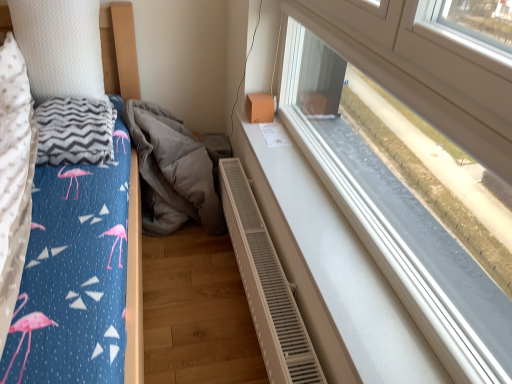
Question: From the image's perspective, is gray fabric at lower center located above or below white textured radiator at lower center?

Choices:
 (A) below
 (B) above

Answer: (B)

Question: Does point (172, 155) appear closer or farther from the camera than point (231, 205)?

Choices:
 (A) farther
 (B) closer

Answer: (A)

Question: Based on their relative distances, which object is farther from the white textured radiator at lower center?

Choices:
 (A) gray zigzag-patterned blanket at left
 (B) gray fabric at lower center
 (C) white plastic window at upper right
 (D) white textured pillow at upper left

Answer: (D)

Question: Which object is the farthest from the white plastic window at upper right?

Choices:
 (A) white textured pillow at upper left
 (B) gray zigzag-patterned blanket at left
 (C) white textured radiator at lower center
 (D) gray fabric at lower center

Answer: (A)